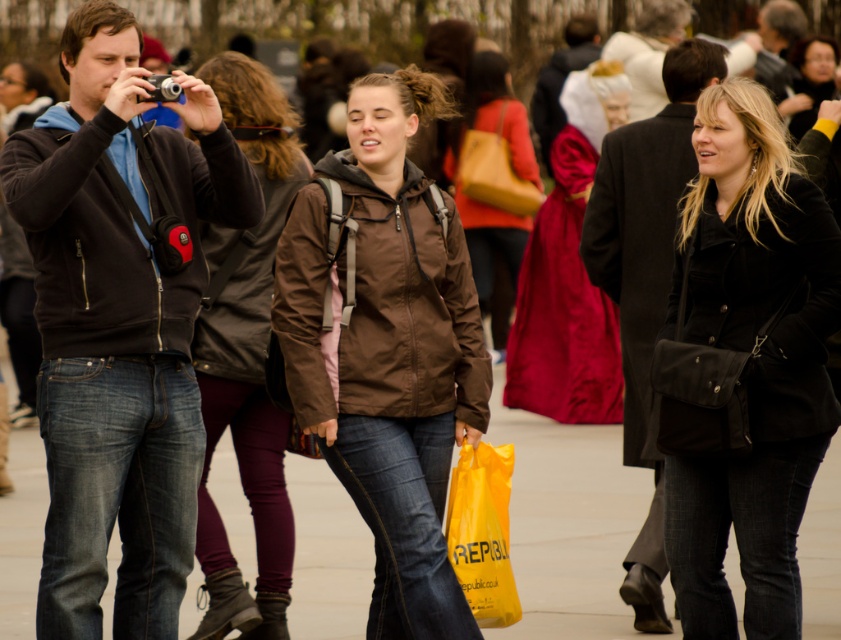
Is matte black jacket at left below black leather coat at right?

Yes.

Looking at this image, between matte black jacket at left and black leather coat at right, which one is positioned lower?

matte black jacket at left is below.

Who is more forward, (182,253) or (622,205)?

Positioned in front is point (182,253).

Where is `matte black jacket at left`? The height and width of the screenshot is (640, 841). matte black jacket at left is located at coordinates (119, 321).

Looking at this image, between brown leather jacket at center and yellow plastic bag at lower center, which one is positioned lower?

yellow plastic bag at lower center

Is point (246, 113) in front of point (482, 480)?

No, it is not.

This screenshot has width=841, height=640. Identify the location of brown leather jacket at center. (246, 358).

Find the location of a particular element. This screenshot has width=841, height=640. brown leather jacket at center is located at coordinates (246, 358).

Consider the image. Who is more forward, (630, 192) or (493, 577)?

Point (493, 577) is in front.

Does point (636, 284) lie in front of point (498, 625)?

No, it is behind (498, 625).

Find the location of a particular element. The width and height of the screenshot is (841, 640). black leather coat at right is located at coordinates (644, 280).